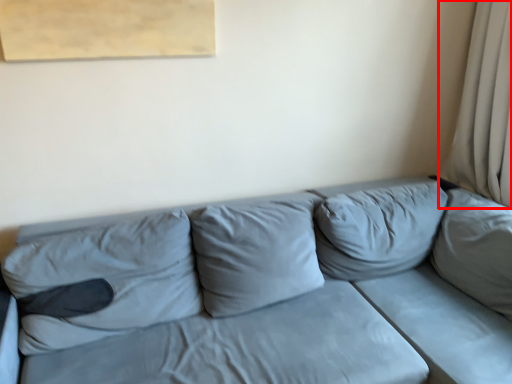
Question: From the image's perspective, what is the correct spatial positioning of curtain (annotated by the red box) in reference to studio couch?

Choices:
 (A) below
 (B) above

Answer: (B)